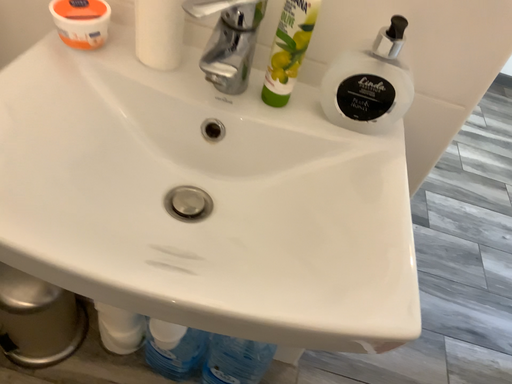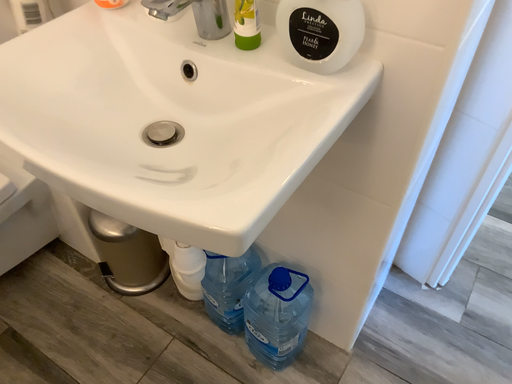
Question: How did the camera likely rotate when shooting the video?

Choices:
 (A) rotated right
 (B) rotated left

Answer: (B)